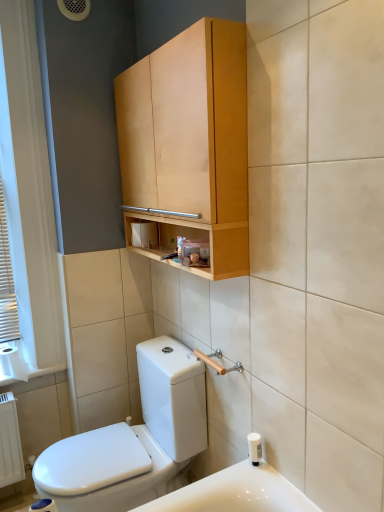
Question: Considering the positions of white paper at left and white plastic soap dispenser at lower right in the image, is white paper at left wider or thinner than white plastic soap dispenser at lower right?

Choices:
 (A) wide
 (B) thin

Answer: (A)

Question: From a real-world perspective, is white paper at left above or below white plastic soap dispenser at lower right?

Choices:
 (A) below
 (B) above

Answer: (B)

Question: Considering the real-world distances, which object is farthest from the white glossy toilet at lower left?

Choices:
 (A) white wooden blinds at left
 (B) white plastic soap dispenser at lower right
 (C) light wood cabinet at upper center
 (D) white paper at left
 (E) white matte toilet paper at center

Answer: (A)

Question: Which object is positioned closest to the white plastic soap dispenser at lower right?

Choices:
 (A) white matte toilet paper at center
 (B) light wood cabinet at upper center
 (C) white wooden blinds at left
 (D) white paper at left
 (E) white glossy toilet at lower left

Answer: (E)